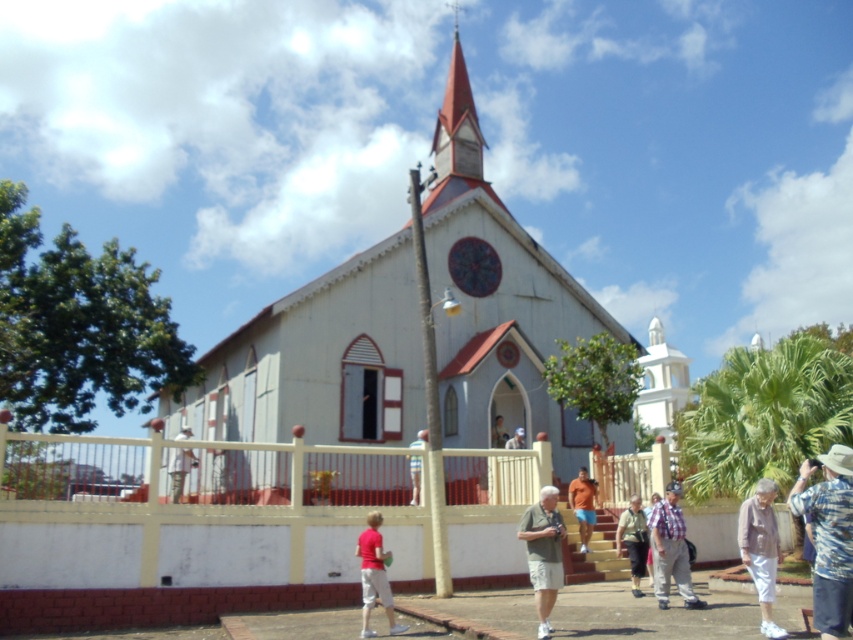
Measure the distance between light brown leather jacket at lower center and camera.

light brown leather jacket at lower center and camera are 40.74 meters apart.

Is light brown leather jacket at lower center closer to camera compared to light brown wooden fence at center?

Yes, light brown leather jacket at lower center is in front of light brown wooden fence at center.

This screenshot has height=640, width=853. Describe the element at coordinates (633, 540) in the screenshot. I see `light brown leather jacket at lower center` at that location.

Locate an element on the screen. The image size is (853, 640). light brown leather jacket at lower center is located at coordinates (633, 540).

Who is positioned more to the left, smooth wood spire at upper center or light brown leather jacket at lower center?

Positioned to the left is smooth wood spire at upper center.

Which of these two, smooth wood spire at upper center or light brown leather jacket at lower center, stands shorter?

light brown leather jacket at lower center is shorter.

The image size is (853, 640). What are the coordinates of `smooth wood spire at upper center` in the screenshot? It's located at (457, 124).

Is point (363, 580) positioned in front of point (639, 550)?

Yes, it is.

Is point (392, 630) less distant than point (642, 563)?

Yes.

Identify the location of matte red shirt at lower center. Image resolution: width=853 pixels, height=640 pixels. (374, 576).